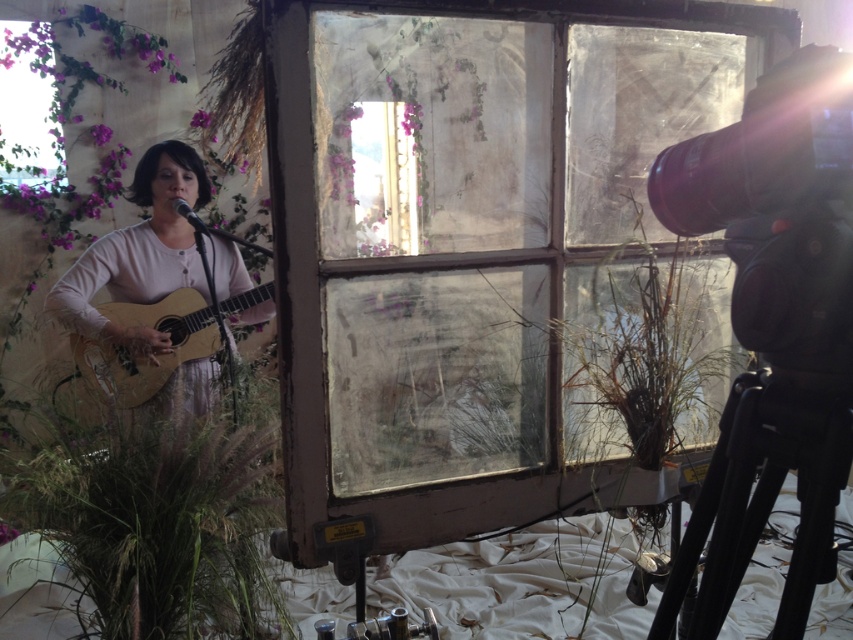
Is point (524, 276) farther from viewer compared to point (112, 461)?

No, (524, 276) is closer to viewer.

Does transparent glass window at center have a lesser height compared to green grass at lower left?

In fact, transparent glass window at center may be taller than green grass at lower left.

Does point (712, 61) lie behind point (207, 618)?

That is False.

This screenshot has width=853, height=640. In order to click on transparent glass window at center in this screenshot , I will do `click(492, 257)`.

Does green grass at lower left have a larger size compared to black matte tripod at lower right?

Correct, green grass at lower left is larger in size than black matte tripod at lower right.

This screenshot has height=640, width=853. Describe the element at coordinates (160, 524) in the screenshot. I see `green grass at lower left` at that location.

Locate an element on the screen. The width and height of the screenshot is (853, 640). green grass at lower left is located at coordinates (160, 524).

Identify the location of green grass at lower left. (160, 524).

Can you confirm if matte pink dress at left is smaller than acoustic wood guitar at left?

No, matte pink dress at left is not smaller than acoustic wood guitar at left.

Does matte pink dress at left appear on the left side of acoustic wood guitar at left?

In fact, matte pink dress at left is to the right of acoustic wood guitar at left.

Identify the location of matte pink dress at left. This screenshot has height=640, width=853. (140, 253).